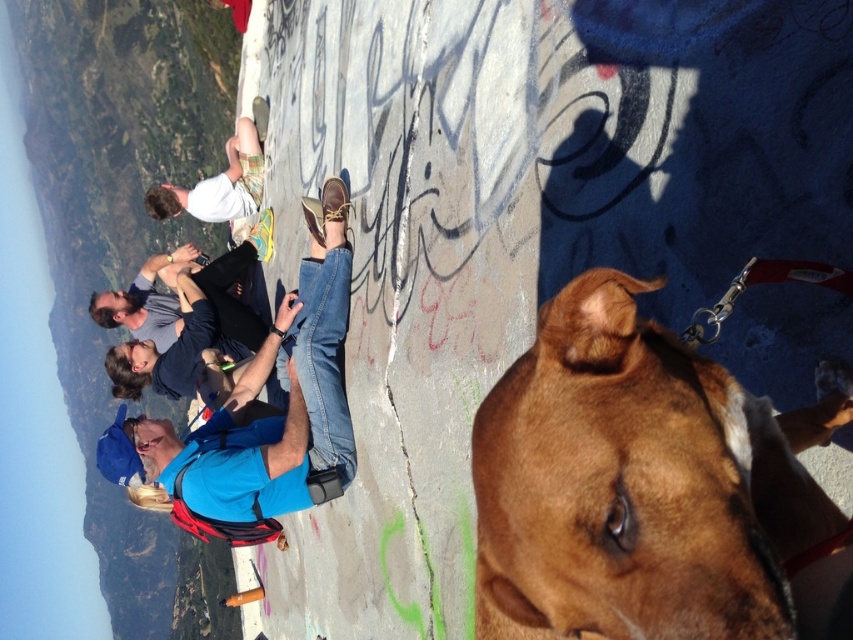
In the scene shown: Is blue fabric shirt at center closer to camera compared to white cotton shirt at upper center?

Yes, it is.

Can you confirm if blue fabric shirt at center is smaller than white cotton shirt at upper center?

Incorrect, blue fabric shirt at center is not smaller in size than white cotton shirt at upper center.

Which is behind, point (299, 404) or point (223, 214)?

The point (223, 214) is behind.

Locate an element on the screen. The image size is (853, 640). blue fabric shirt at center is located at coordinates (270, 410).

Can you confirm if brown smooth dog at center is bigger than white cotton shirt at upper center?

No, brown smooth dog at center is not bigger than white cotton shirt at upper center.

Is brown smooth dog at center behind white cotton shirt at upper center?

No, brown smooth dog at center is in front of white cotton shirt at upper center.

The height and width of the screenshot is (640, 853). What do you see at coordinates (648, 488) in the screenshot?
I see `brown smooth dog at center` at bounding box center [648, 488].

Find the location of a particular element. The image size is (853, 640). brown smooth dog at center is located at coordinates (648, 488).

Is brown smooth dog at center to the right of blue fabric shirt at center from the viewer's perspective?

Correct, you'll find brown smooth dog at center to the right of blue fabric shirt at center.

Can you confirm if brown smooth dog at center is wider than blue fabric shirt at center?

No.

Does point (531, 620) come behind point (352, 456)?

No, it is not.

Locate an element on the screen. This screenshot has width=853, height=640. brown smooth dog at center is located at coordinates (648, 488).